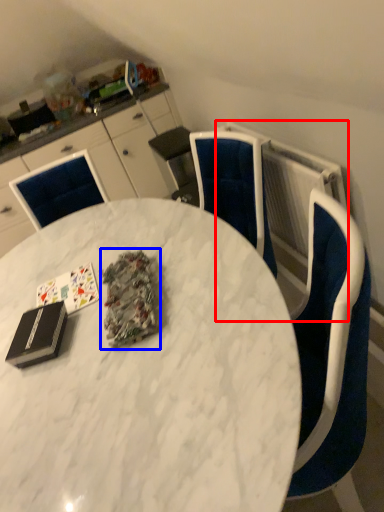
Question: Which of the following is the farthest to the observer, radiator (highlighted by a red box) or debris (highlighted by a blue box)?

Choices:
 (A) radiator
 (B) debris

Answer: (A)